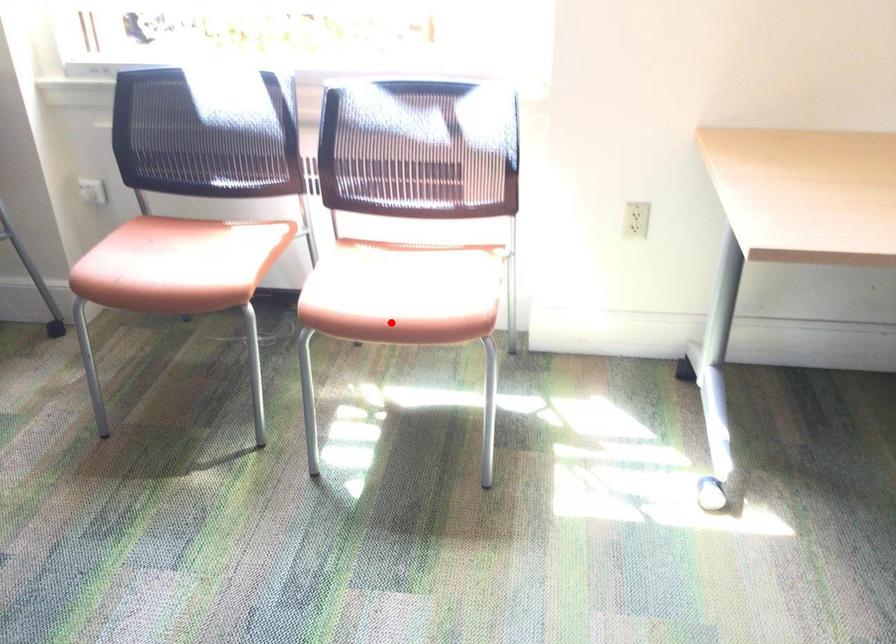
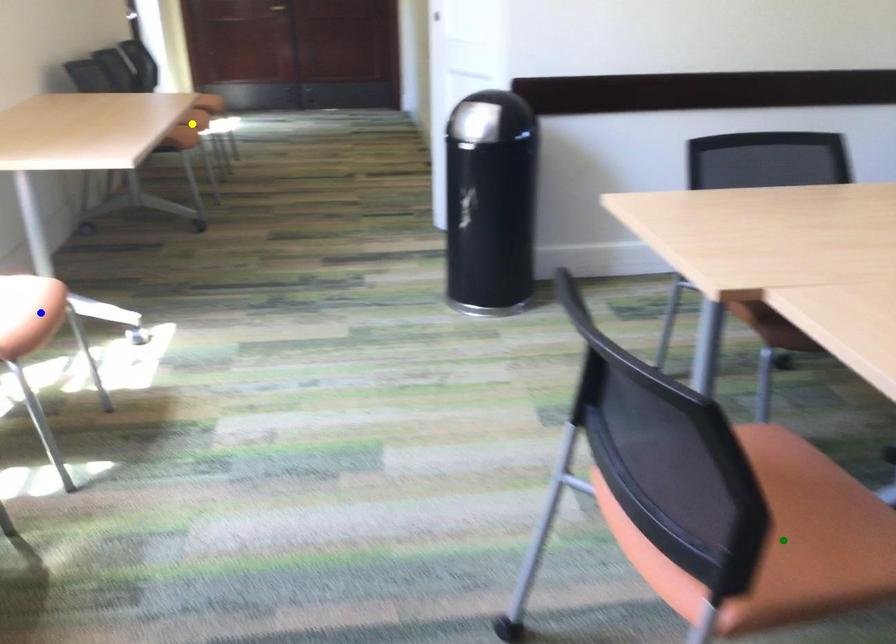
Question: I am providing you with two images of the same scene from different viewpoints. A red point is marked on the first image. You are given multiple points on the second image. Which spot in image 2 lines up with the point in image 1?

Choices:
 (A) blue point
 (B) yellow point
 (C) green point

Answer: (A)